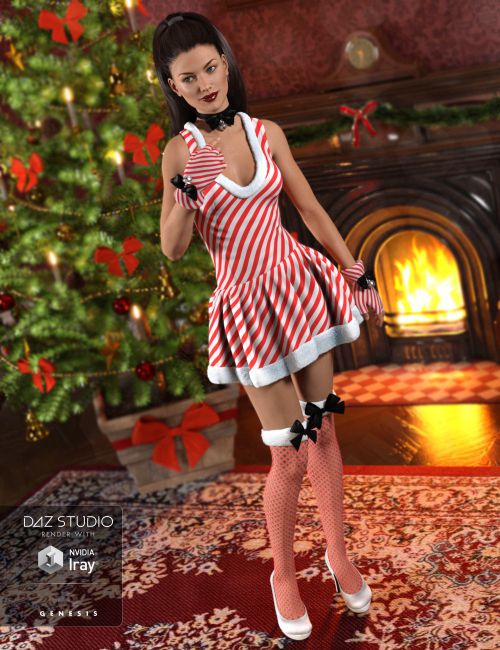
At what (x,y) coordinates should I click in order to perform the action: click on wall. Please return your answer as a coordinate pair (x, y). This screenshot has height=650, width=500. Looking at the image, I should click on (274, 23).